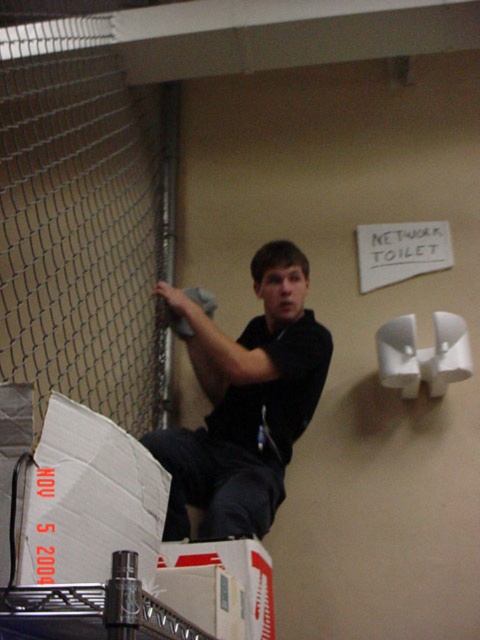
Question: Is black matte shirt at upper center above white cardboard box at lower center?

Choices:
 (A) no
 (B) yes

Answer: (B)

Question: Is black matte shirt at upper center below white cardboard box at lower center?

Choices:
 (A) no
 (B) yes

Answer: (A)

Question: Which point appears farthest from the camera in this image?

Choices:
 (A) (204, 452)
 (B) (225, 561)

Answer: (A)

Question: Which point appears farthest from the camera in this image?

Choices:
 (A) (252, 500)
 (B) (189, 557)

Answer: (A)

Question: Among these objects, which one is nearest to the camera?

Choices:
 (A) black matte shirt at upper center
 (B) white cardboard box at lower center

Answer: (B)

Question: Where is black matte shirt at upper center located in relation to white cardboard box at lower center in the image?

Choices:
 (A) above
 (B) below

Answer: (A)